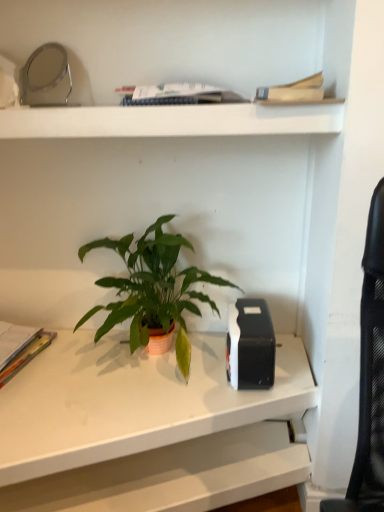
Question: Looking at their shapes, would you say multicolored paper at left, arranged as the second paperback book when viewed from the front, is wider or thinner than white matte desk at center?

Choices:
 (A) thin
 (B) wide

Answer: (A)

Question: Visually, is multicolored paper at left, which is counted as the first paperback book, starting from the left, positioned to the left or to the right of white matte desk at center?

Choices:
 (A) left
 (B) right

Answer: (A)

Question: Estimate the real-world distances between objects in this image. Which object is farther from the green matte houseplant at center?

Choices:
 (A) hardcover book at upper center, which ranks as the first paperback book in right-to-left order
 (B) multicolored paper at left, which is the first paperback book in bottom-to-top order
 (C) white matte desk at center
 (D) white matte shelf at upper center

Answer: (A)

Question: Which object is the closest to the hardcover book at upper center, which is the first paperback book from front to back?

Choices:
 (A) white matte shelf at upper center
 (B) green matte houseplant at center
 (C) white matte desk at center
 (D) multicolored paper at left, arranged as the second paperback book when viewed from the front

Answer: (A)